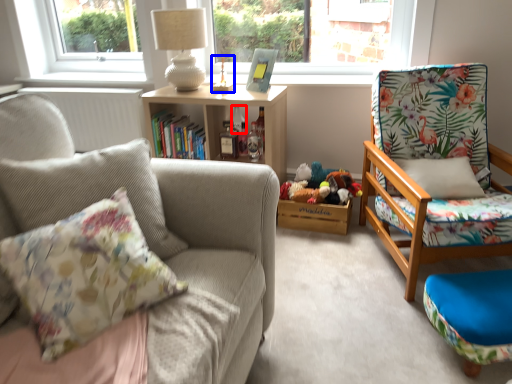
Question: Which object is closer to the camera taking this photo, bottle (highlighted by a red box) or toy (highlighted by a blue box)?

Choices:
 (A) bottle
 (B) toy

Answer: (B)